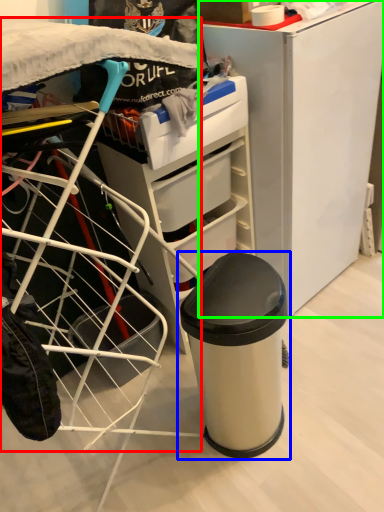
Question: Estimate the real-world distances between objects in this image. Which object is farther from wide (highlighted by a red box), waste container (highlighted by a blue box) or furniture (highlighted by a green box)?

Choices:
 (A) waste container
 (B) furniture

Answer: (B)